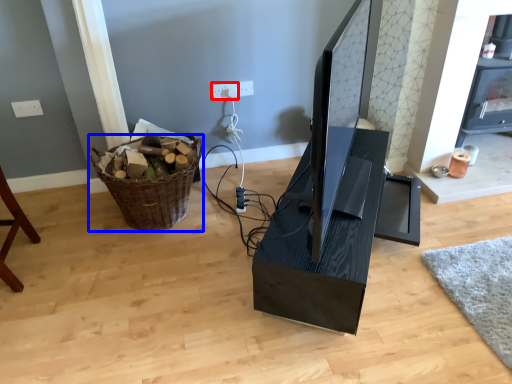
Question: Which object appears closest to the camera in this image, electric outlet (highlighted by a red box) or basket (highlighted by a blue box)?

Choices:
 (A) electric outlet
 (B) basket

Answer: (B)